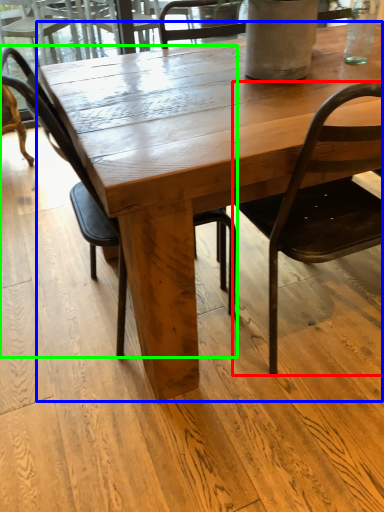
Question: Which object is positioned closest to chair (highlighted by a red box)? Select from coffee table (highlighted by a blue box) and chair (highlighted by a green box).

Choices:
 (A) coffee table
 (B) chair

Answer: (A)